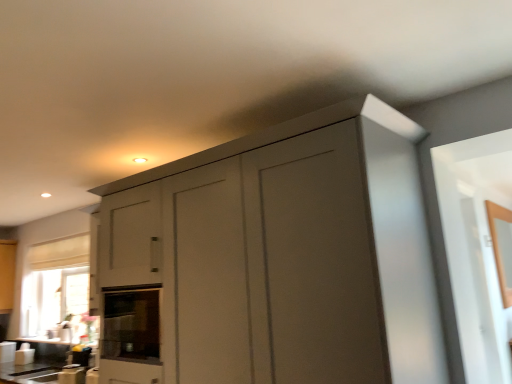
Question: Is matte gray cabinet at center shorter than white glossy countertop at lower left, positioned as the 1th counter top in back-to-front order?

Choices:
 (A) no
 (B) yes

Answer: (A)

Question: Considering the relative sizes of matte gray cabinet at center and white glossy countertop at lower left, positioned as the 1th counter top in back-to-front order, in the image provided, is matte gray cabinet at center taller than white glossy countertop at lower left, positioned as the 1th counter top in back-to-front order,?

Choices:
 (A) yes
 (B) no

Answer: (A)

Question: Does matte gray cabinet at center have a larger size compared to white glossy countertop at lower left, positioned as the 1th counter top in back-to-front order?

Choices:
 (A) no
 (B) yes

Answer: (B)

Question: Can you confirm if matte gray cabinet at center is positioned to the right of white glossy countertop at lower left, the second counter top viewed from the front?

Choices:
 (A) yes
 (B) no

Answer: (A)

Question: Does matte gray cabinet at center lie in front of white glossy countertop at lower left, the second counter top viewed from the front?

Choices:
 (A) no
 (B) yes

Answer: (B)

Question: From a real-world perspective, relative to white glossy countertop at lower left, positioned as the 1th counter top in back-to-front order, is white glossy countertop at lower center, which appears as the 1th counter top when viewed from the front, vertically above or below?

Choices:
 (A) above
 (B) below

Answer: (B)

Question: Is point (1, 382) positioned closer to the camera than point (55, 339)?

Choices:
 (A) farther
 (B) closer

Answer: (B)

Question: Is white glossy countertop at lower center, which appears as the 1th counter top when viewed from the front, taller or shorter than white glossy countertop at lower left, positioned as the 1th counter top in back-to-front order?

Choices:
 (A) short
 (B) tall

Answer: (B)

Question: Is white glossy countertop at lower center, the 2th counter top positioned from the back, bigger or smaller than white glossy countertop at lower left, the second counter top viewed from the front?

Choices:
 (A) big
 (B) small

Answer: (A)

Question: Is white glossy countertop at lower center, the 2th counter top positioned from the back, bigger or smaller than matte gray cabinet at center?

Choices:
 (A) small
 (B) big

Answer: (A)

Question: In the image, is white glossy countertop at lower center, which appears as the 1th counter top when viewed from the front, positioned in front of or behind matte gray cabinet at center?

Choices:
 (A) front
 (B) behind

Answer: (B)

Question: Is white glossy countertop at lower center, which appears as the 1th counter top when viewed from the front, taller or shorter than matte gray cabinet at center?

Choices:
 (A) short
 (B) tall

Answer: (A)

Question: Is white glossy countertop at lower center, the 2th counter top positioned from the back, to the left or to the right of matte gray cabinet at center in the image?

Choices:
 (A) right
 (B) left

Answer: (B)

Question: In terms of height, does white glossy countertop at lower left, positioned as the 1th counter top in back-to-front order, look taller or shorter compared to white glossy countertop at lower center, which appears as the 1th counter top when viewed from the front?

Choices:
 (A) tall
 (B) short

Answer: (B)

Question: Is point (73, 339) closer or farther from the camera than point (19, 367)?

Choices:
 (A) farther
 (B) closer

Answer: (A)